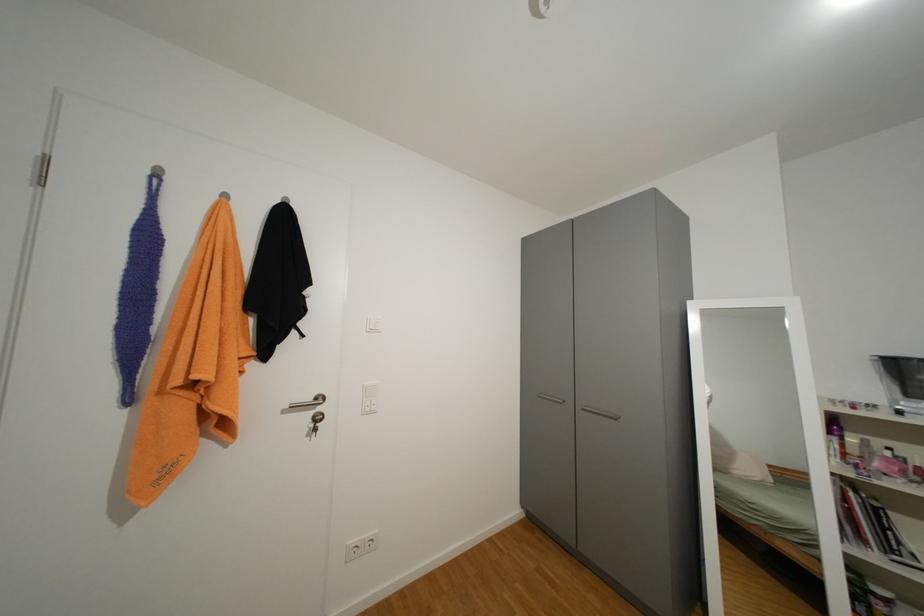
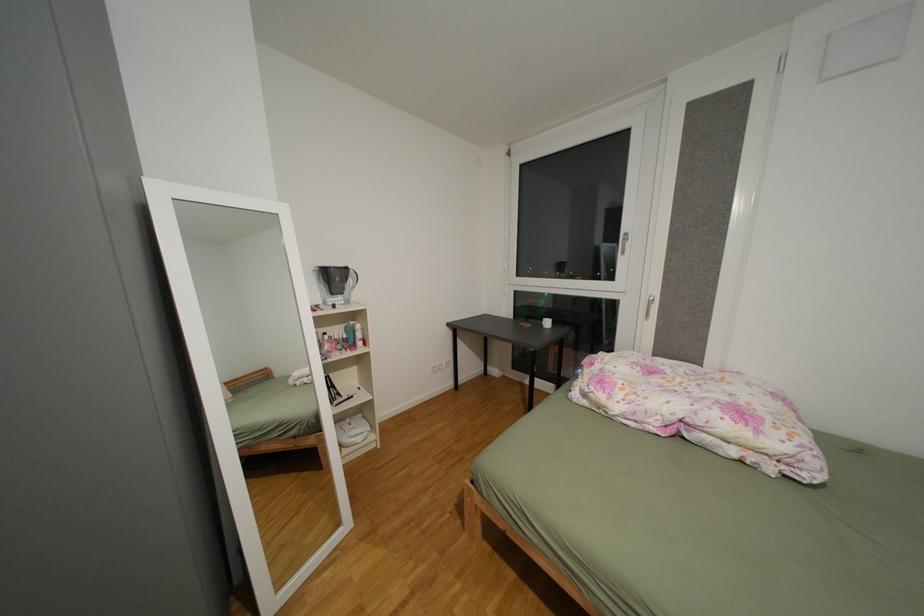
Question: Based on the continuous images, in which direction is the camera rotating? Reply with the corresponding letter.

Choices:
 (A) Left
 (B) Right
 (C) Up
 (D) Down

Answer: (B)